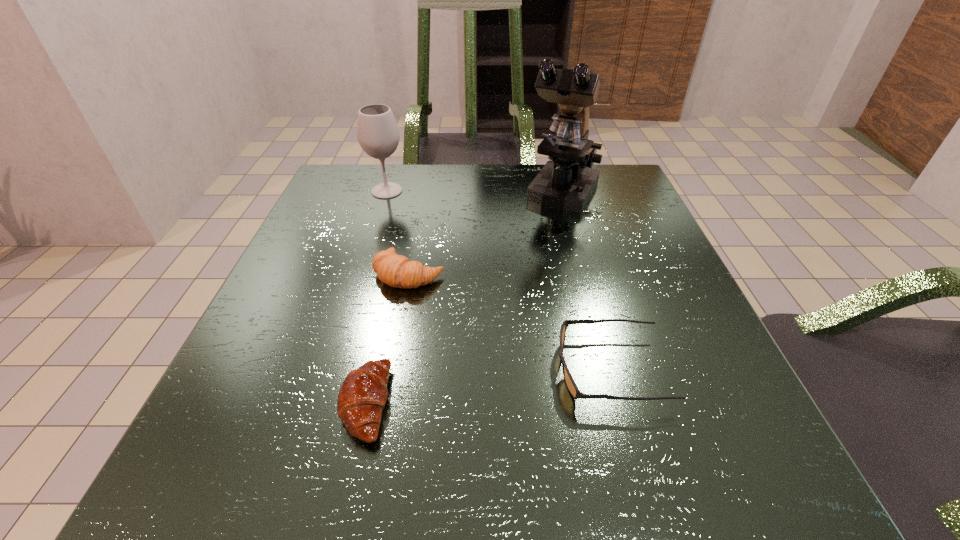
The height and width of the screenshot is (540, 960). In the image, there is a desktop. In order to click on vacant region at the far edge in this screenshot , I will do `click(468, 209)`.

This screenshot has height=540, width=960. In the image, there is a desktop. In order to click on vacant space at the near edge in this screenshot , I will do `click(388, 497)`.

Locate an element on the screen. free space at the left edge is located at coordinates (280, 308).

Image resolution: width=960 pixels, height=540 pixels. What are the coordinates of `free location at the right edge of the desktop` in the screenshot? It's located at (643, 233).

Locate an element on the screen. free region at the far left corner of the desktop is located at coordinates (354, 174).

The height and width of the screenshot is (540, 960). In the image, there is a desktop. In order to click on free space at the far right corner in this screenshot , I will do `click(632, 200)`.

Locate an element on the screen. vacant space at the near right corner is located at coordinates (673, 461).

Locate an element on the screen. vacant point located between the microscope and the sunglasses is located at coordinates (587, 282).

This screenshot has width=960, height=540. In order to click on free point between the sunglasses and the microscope in this screenshot , I will do `click(587, 282)`.

You are a GUI agent. You are given a task and a screenshot of the screen. Output one action in this format:
    pyautogui.click(x=<x>, y=<y>)
    Task: Click on the blank region between the farther crescent roll and the sunglasses
    
    Given the screenshot: What is the action you would take?
    pyautogui.click(x=510, y=321)